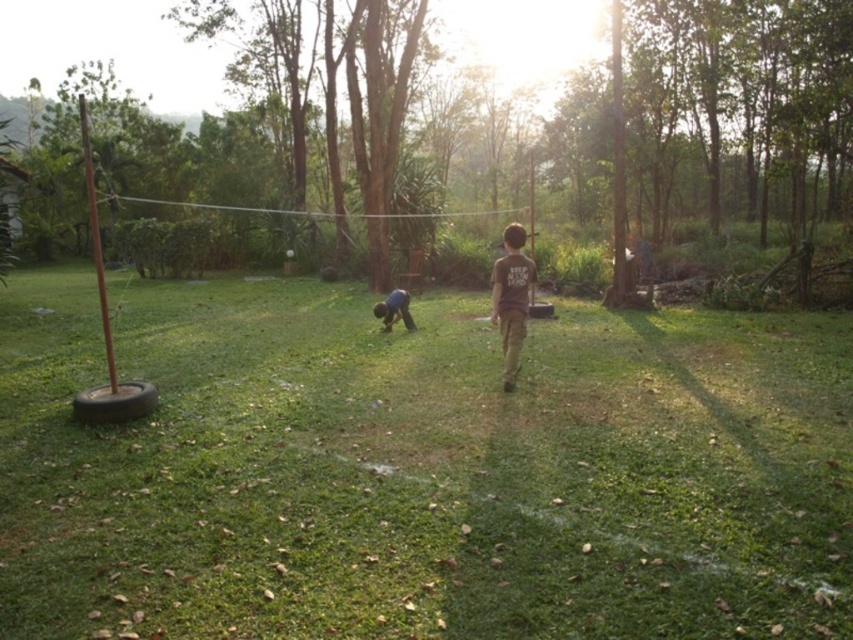
You are organizing a small outdoor event and need to determine which item is narrower between the brown cotton shirt at center and the dark blue fabric at center. Which one should you choose?

The brown cotton shirt at center has a lesser width compared to the dark blue fabric at center, so you should choose the brown cotton shirt at center as it is narrower.